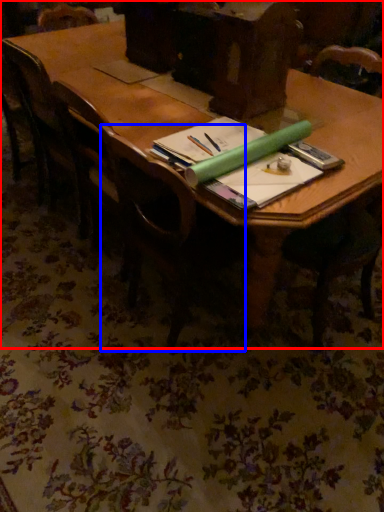
Question: Which object is closer to the camera taking this photo, table (highlighted by a red box) or chair (highlighted by a blue box)?

Choices:
 (A) table
 (B) chair

Answer: (A)